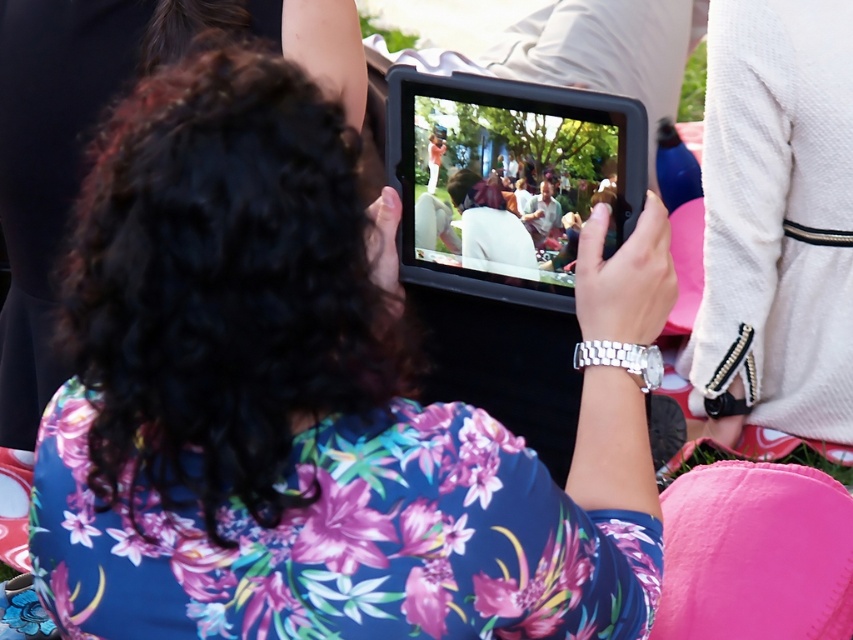
You are a photographer trying to capture a candid shot of the person wearing the floral fabric shirt at center. Your camera is positioned at a certain distance. Based on the scene, can you determine if you need to adjust your camera closer or farther away to focus on the shirt?

The floral fabric shirt at center and camera are 35.52 inches apart. To focus on the shirt, you need to adjust the camera closer since the distance is within a typical focusing range for candid shots.

You are standing in front of the person with curly dark hair and want to place a small sticker on either the point at coordinates point (80, 234) or point (566, 129). Which point is closer to you?

Point (80, 234) is closer to the viewer than point (566, 129), so you should place the sticker on point (80, 234).